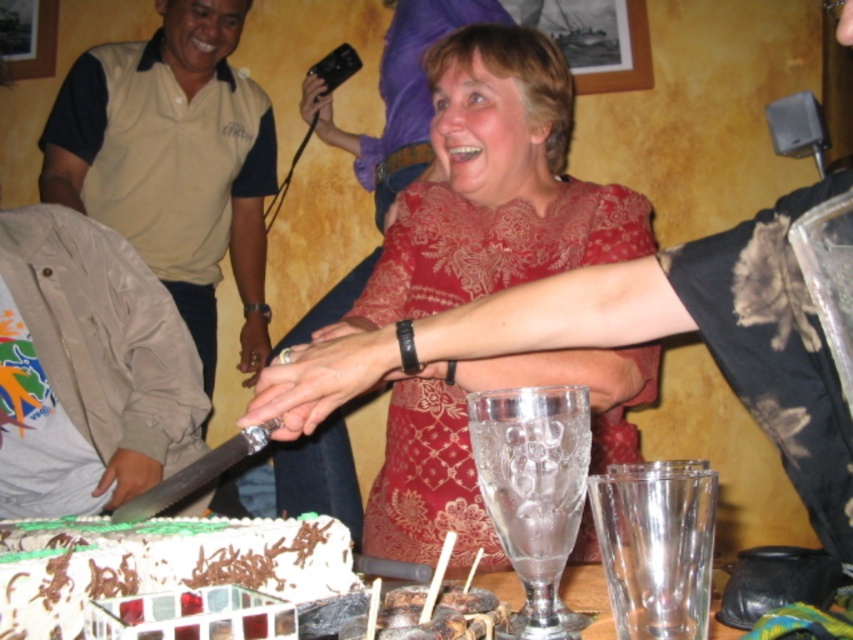
Based on the photo, you are a photographer at the event and want to capture the matte red dress at center and the translucent glass cups at lower center clearly in the same frame. Which object should you focus on first to ensure both are in focus?

The matte red dress at center is positioned over translucent glass cups at lower center, so you should focus on the matte red dress at center first to ensure both are in focus.

You are standing at the center of the room and want to take a photo of the matte red dress at center. Which direction should you move to get closer to it?

Since the matte red dress at center is located at point coordinates of 0.294 on the x axis and 0.580 on the y axis, you should move towards the left and forward to reach it.